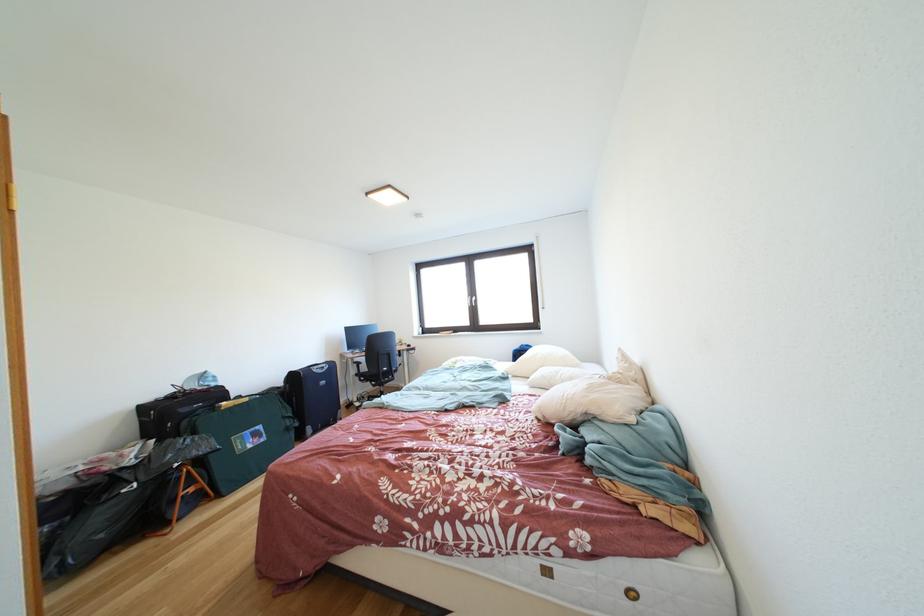
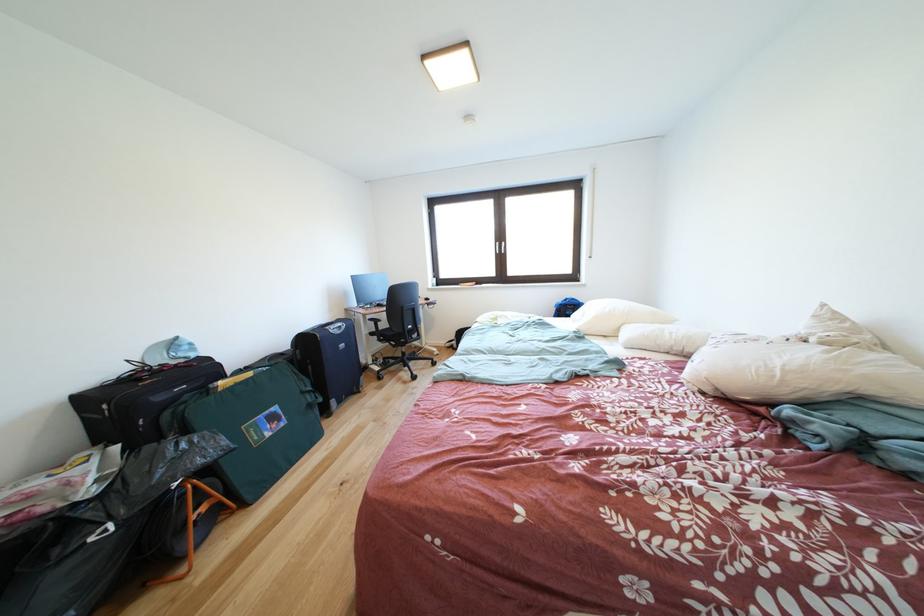
In the second image, find the point that corresponds to [383,391] in the first image.

(403, 351)